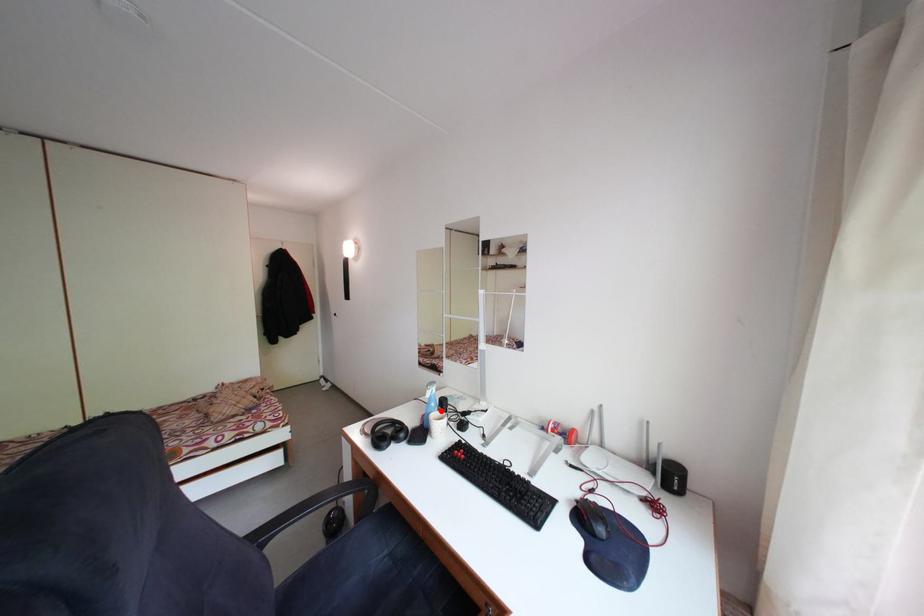
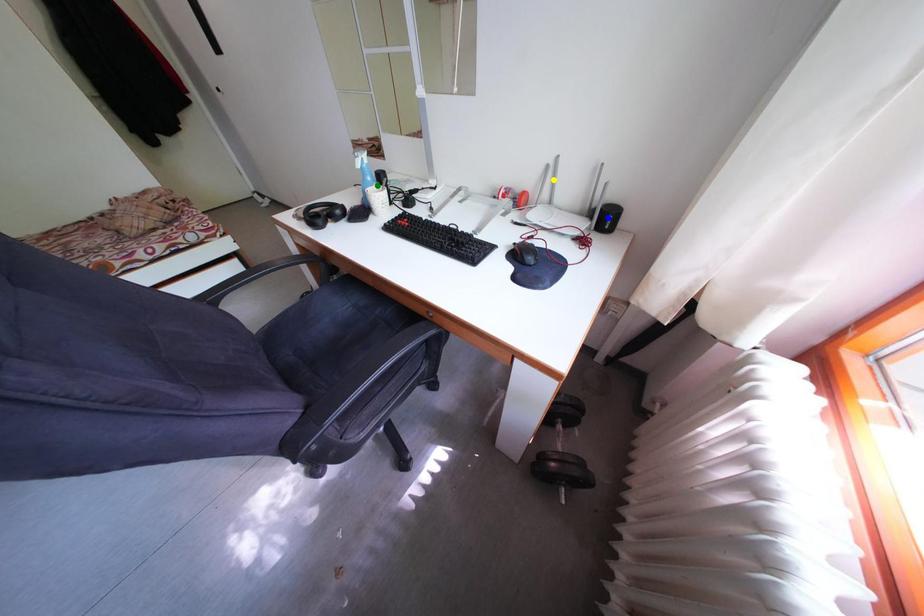
Question: I am providing you with two images of the same scene from different viewpoints. A red point is marked on the first image. You are given multiple points on the second image. In image 2, which mark is for the same physical point as the one in image 1?

Choices:
 (A) green point
 (B) blue point
 (C) yellow point

Answer: (A)